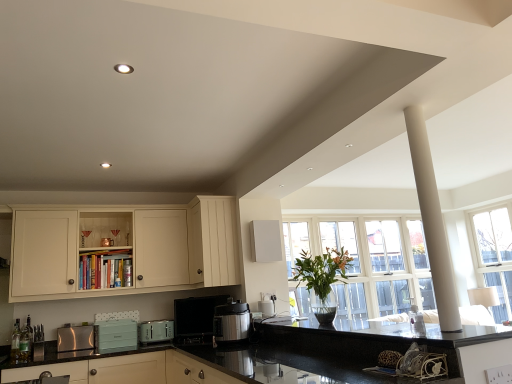
Question: Is metallic silver coffee maker at center, positioned as the 4th appliance in left-to-right order, situated inside matte cream cabinets at lower center, the 3th cabinetry when ordered from top to bottom, or outside?

Choices:
 (A) inside
 (B) outside

Answer: (B)

Question: From a real-world perspective, relative to matte cream cabinets at lower center, placed as the 1th cabinetry when sorted from bottom to top, is metallic silver coffee maker at center, which is counted as the 1th appliance, starting from the right, vertically above or below?

Choices:
 (A) below
 (B) above

Answer: (B)

Question: Which object is the closest to the black granite countertop at center, the 1th countertop when ordered from left to right?

Choices:
 (A) green glass bottle at lower left, positioned as the second bottle in left-to-right order
 (B) teal matte toaster at center, positioned as the 2th appliance in left-to-right order
 (C) matte cream cabinet at upper center, placed as the 1th cabinetry when sorted from top to bottom
 (D) black glossy countertop at center, the 1th countertop positioned from the right
 (E) cream matte cabinet at upper left, which is counted as the second cabinetry, starting from the top

Answer: (D)

Question: Based on their relative distances, which object is farther from the black glossy countertop at center, which is counted as the second countertop, starting from the left?

Choices:
 (A) cream matte cabinet at upper left, which is counted as the second cabinetry, starting from the bottom
 (B) clear glass window at upper right
 (C) black granite countertop at center, the 1th countertop when ordered from left to right
 (D) metallic silver can at upper left, the first bottle positioned from the top
 (E) metallic silver coffee maker at center, positioned as the 4th appliance in left-to-right order

Answer: (B)